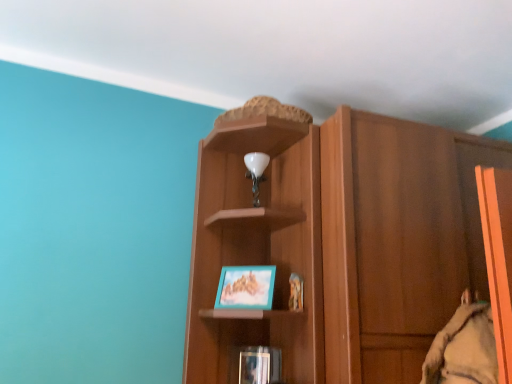
Find the location of `wooden cupboard at center`. wooden cupboard at center is located at coordinates (338, 242).

What do you see at coordinates (338, 242) in the screenshot? This screenshot has height=384, width=512. I see `wooden cupboard at center` at bounding box center [338, 242].

Find the location of a particular element. matte black book at lower center is located at coordinates (260, 365).

Is wooden cupboard at center further to the viewer compared to matte black book at lower center?

No, wooden cupboard at center is closer to the viewer.

Between wooden cupboard at center and matte black book at lower center, which one has less height?

matte black book at lower center is shorter.

Image resolution: width=512 pixels, height=384 pixels. I want to click on cupboard above the matte black book at lower center (from a real-world perspective), so click(338, 242).

Considering the relative sizes of wooden cupboard at center and matte black book at lower center in the image provided, is wooden cupboard at center thinner than matte black book at lower center?

No, wooden cupboard at center is not thinner than matte black book at lower center.

Measure the distance between teal matte picture frame at center and matte black book at lower center.

9.35 inches.

Is teal matte picture frame at center positioned in front of matte black book at lower center?

Yes.

Consider the image. Could you tell me if teal matte picture frame at center is facing matte black book at lower center?

No, teal matte picture frame at center is not aimed at matte black book at lower center.

Does point (253, 288) appear closer or farther from the camera than point (239, 365)?

Point (253, 288) appears to be closer to the viewer than point (239, 365).

From the image's perspective, which one is positioned higher, matte black book at lower center or wooden cupboard at center?

From the image's view, wooden cupboard at center is above.

Does matte black book at lower center have a lesser height compared to wooden cupboard at center?

Correct, matte black book at lower center is not as tall as wooden cupboard at center.

Are matte black book at lower center and wooden cupboard at center far apart?

No, matte black book at lower center is in close proximity to wooden cupboard at center.

Who is smaller, matte black book at lower center or wooden cupboard at center?

matte black book at lower center is smaller.

Considering the relative sizes of teal matte picture frame at center and wooden cupboard at center in the image provided, is teal matte picture frame at center bigger than wooden cupboard at center?

Incorrect, teal matte picture frame at center is not larger than wooden cupboard at center.

How distant is teal matte picture frame at center from wooden cupboard at center?

The distance of teal matte picture frame at center from wooden cupboard at center is 13.01 inches.

Could you tell me if teal matte picture frame at center is facing wooden cupboard at center?

No, teal matte picture frame at center does not turn towards wooden cupboard at center.

From a real-world perspective, which is physically below, matte black book at lower center or teal matte picture frame at center?

From a 3D spatial view, matte black book at lower center is below.

Between point (270, 374) and point (252, 270), which one is positioned behind?

The point (252, 270) is more distant.

Considering the sizes of objects matte black book at lower center and teal matte picture frame at center in the image provided, who is wider, matte black book at lower center or teal matte picture frame at center?

teal matte picture frame at center.

Consider the image. Is matte black book at lower center oriented away from teal matte picture frame at center?

matte black book at lower center does not have its back to teal matte picture frame at center.

Can you tell me how much wooden cupboard at center and teal matte picture frame at center differ in facing direction?

The angular difference between wooden cupboard at center and teal matte picture frame at center is 40.1 degrees.

Is wooden cupboard at center directly adjacent to teal matte picture frame at center?

wooden cupboard at center is not next to teal matte picture frame at center, and they're not touching.

Is wooden cupboard at center at the left side of teal matte picture frame at center?

No.

Could you tell me if wooden cupboard at center is facing teal matte picture frame at center?

No.

Image resolution: width=512 pixels, height=384 pixels. I want to click on cupboard on the right side of matte black book at lower center, so click(338, 242).

The image size is (512, 384). Find the location of `picture frame on the left of matte black book at lower center`. picture frame on the left of matte black book at lower center is located at coordinates (246, 287).

Which object lies nearer to the anchor point teal matte picture frame at center, matte black book at lower center or wooden cupboard at center?

The object closer to teal matte picture frame at center is matte black book at lower center.

When comparing their distances from matte black book at lower center, does teal matte picture frame at center or wooden cupboard at center seem further?

wooden cupboard at center lies further to matte black book at lower center than the other object.

From the image, which object appears to be farther from wooden cupboard at center, matte black book at lower center or teal matte picture frame at center?

matte black book at lower center is positioned further to the anchor wooden cupboard at center.

Which object lies nearer to the anchor point teal matte picture frame at center, wooden cupboard at center or matte black book at lower center?

The object closer to teal matte picture frame at center is matte black book at lower center.

From the image, which object appears to be farther from matte black book at lower center, wooden cupboard at center or teal matte picture frame at center?

The object further to matte black book at lower center is wooden cupboard at center.

Estimate the real-world distances between objects in this image. Which object is closer to wooden cupboard at center, teal matte picture frame at center or matte black book at lower center?

teal matte picture frame at center is positioned closer to the anchor wooden cupboard at center.

Identify the location of book between teal matte picture frame at center and wooden cupboard at center. (260, 365).